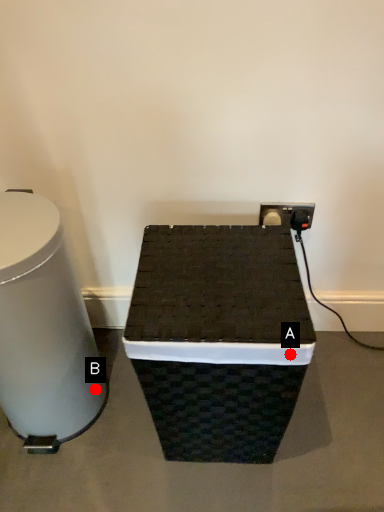
Question: Two points are circled on the image, labeled by A and B beside each circle. Which point is farther to the camera?

Choices:
 (A) A is further
 (B) B is further

Answer: (B)